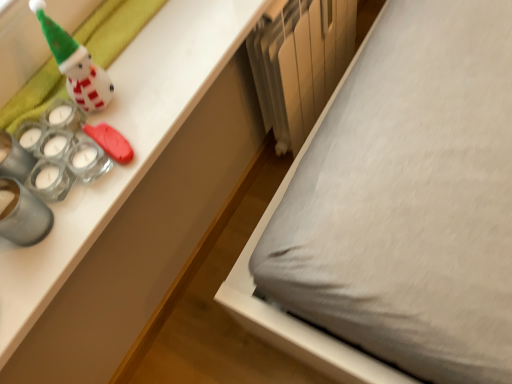
Question: Is point (224, 129) positioned closer to the camera than point (104, 92)?

Choices:
 (A) closer
 (B) farther

Answer: (B)

Question: Looking at the image, does white glossy desk at upper left seem bigger or smaller compared to white glossy snowman at upper left?

Choices:
 (A) small
 (B) big

Answer: (B)

Question: Considering the real-world distances, which object is farthest from the white glossy desk at upper left?

Choices:
 (A) metallic silver radiator at lower center
 (B) white glossy snowman at upper left

Answer: (B)

Question: Estimate the real-world distances between objects in this image. Which object is farther from the white glossy desk at upper left?

Choices:
 (A) metallic silver radiator at lower center
 (B) white glossy snowman at upper left

Answer: (B)